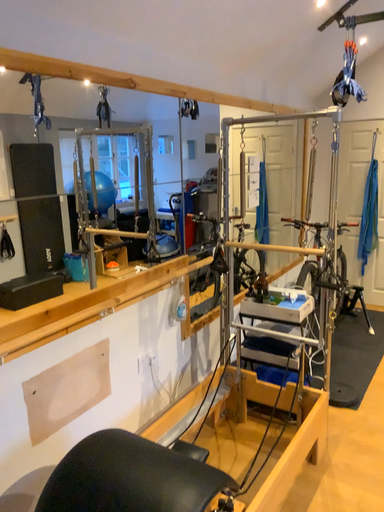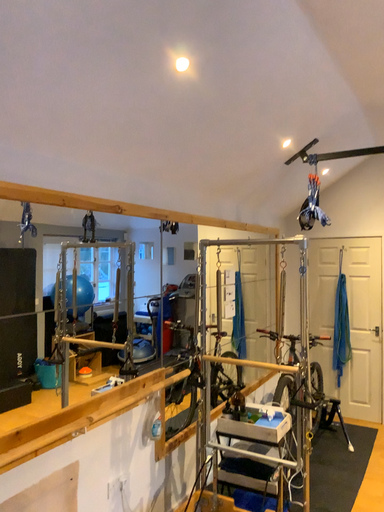
Question: How did the camera likely rotate when shooting the video?

Choices:
 (A) rotated upward
 (B) rotated downward

Answer: (A)